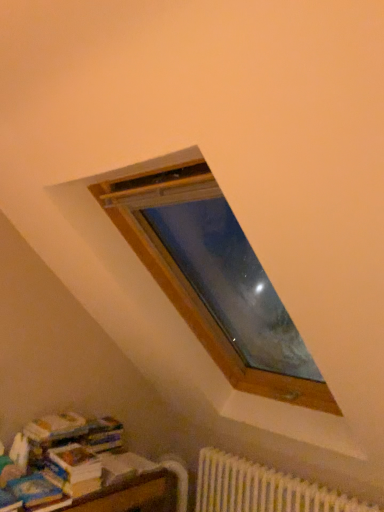
Describe the element at coordinates (34, 490) in the screenshot. The height and width of the screenshot is (512, 384). I see `blue matte paperback book at lower left` at that location.

At what (x,y) coordinates should I click in order to perform the action: click on white plastic radiator at lower right. Please return your answer as a coordinate pair (x, y). This screenshot has height=512, width=384. Looking at the image, I should click on (262, 489).

Describe the element at coordinates (56, 461) in the screenshot. I see `white paper book at lower left` at that location.

Locate an element on the screen. The image size is (384, 512). blue matte paperback book at lower left is located at coordinates (34, 490).

Is blue matte paperback book at lower left wider than white plastic radiator at lower right?

Correct, the width of blue matte paperback book at lower left exceeds that of white plastic radiator at lower right.

Between blue matte paperback book at lower left and white plastic radiator at lower right, which one is positioned in front?

blue matte paperback book at lower left is in front.

This screenshot has height=512, width=384. In order to click on paperback book that is in front of the white plastic radiator at lower right in this screenshot , I will do `click(34, 490)`.

Considering the relative sizes of blue matte paperback book at lower left and white plastic radiator at lower right in the image provided, is blue matte paperback book at lower left taller than white plastic radiator at lower right?

Incorrect, the height of blue matte paperback book at lower left is not larger of that of white plastic radiator at lower right.

Is white paper book at lower left with white plastic radiator at lower right?

No, white paper book at lower left is not making contact with white plastic radiator at lower right.

Is white plastic radiator at lower right surrounded by white paper book at lower left?

No.

Considering the sizes of objects white paper book at lower left and white plastic radiator at lower right in the image provided, who is bigger, white paper book at lower left or white plastic radiator at lower right?

Bigger between the two is white plastic radiator at lower right.

From a real-world perspective, is white paper book at lower left physically located above or below white plastic radiator at lower right?

white paper book at lower left is above white plastic radiator at lower right.

Would you say white plastic radiator at lower right is a long distance from white paper book at lower left?

No, there isn't a large distance between white plastic radiator at lower right and white paper book at lower left.

Locate an element on the screen. The image size is (384, 512). book above the white plastic radiator at lower right (from the image's perspective) is located at coordinates (56, 461).

Is white plastic radiator at lower right surrounding white paper book at lower left?

No, white plastic radiator at lower right does not contain white paper book at lower left.

Relative to white paper book at lower left, is white plastic radiator at lower right in front or behind?

Clearly, white plastic radiator at lower right is in front of white paper book at lower left.

Does blue matte paperback book at lower left touch white paper book at lower left?

No.

From a real-world perspective, does blue matte paperback book at lower left sit lower than white paper book at lower left?

Indeed, from a real-world perspective, blue matte paperback book at lower left is positioned beneath white paper book at lower left.

Is white paper book at lower left at the back of blue matte paperback book at lower left?

blue matte paperback book at lower left does not have its back to white paper book at lower left.

Would you say blue matte paperback book at lower left is inside or outside white paper book at lower left?

blue matte paperback book at lower left is not enclosed by white paper book at lower left.

Do you think white plastic radiator at lower right is within blue matte paperback book at lower left, or outside of it?

white plastic radiator at lower right is spatially situated outside blue matte paperback book at lower left.

Between white plastic radiator at lower right and blue matte paperback book at lower left, which one appears on the left side from the viewer's perspective?

Positioned to the left is blue matte paperback book at lower left.

Is blue matte paperback book at lower left at the back of white plastic radiator at lower right?

No.

From a real-world perspective, which is physically above, white plastic radiator at lower right or blue matte paperback book at lower left?

blue matte paperback book at lower left, from a real-world perspective.

From a real-world perspective, is white paper book at lower left physically below blue matte paperback book at lower left?

Actually, white paper book at lower left is physically above blue matte paperback book at lower left in the real world.

How many degrees apart are the facing directions of white paper book at lower left and blue matte paperback book at lower left?

The facing directions of white paper book at lower left and blue matte paperback book at lower left are 0.768 degrees apart.

Is white paper book at lower left facing away from blue matte paperback book at lower left?

No, white paper book at lower left is not facing away from blue matte paperback book at lower left.

Which of these two, white paper book at lower left or blue matte paperback book at lower left, stands taller?

white paper book at lower left is taller.

The width and height of the screenshot is (384, 512). Identify the location of paperback book on the left of white plastic radiator at lower right. pos(34,490).

In the image, there is a white plastic radiator at lower right. At what (x,y) coordinates should I click in order to perform the action: click on book above it (from the image's perspective). Please return your answer as a coordinate pair (x, y). This screenshot has height=512, width=384. Looking at the image, I should click on (56, 461).

Considering their positions, is white paper book at lower left positioned further to white plastic radiator at lower right than blue matte paperback book at lower left?

Among the two, blue matte paperback book at lower left is located further to white plastic radiator at lower right.

From the image, which object appears to be nearer to white plastic radiator at lower right, blue matte paperback book at lower left or white paper book at lower left?

white paper book at lower left is closer to white plastic radiator at lower right.

Looking at the image, which one is located closer to white paper book at lower left, blue matte paperback book at lower left or white plastic radiator at lower right?

Among the two, blue matte paperback book at lower left is located nearer to white paper book at lower left.

Based on their spatial positions, is white paper book at lower left or white plastic radiator at lower right further from blue matte paperback book at lower left?

The object further to blue matte paperback book at lower left is white plastic radiator at lower right.

Looking at the image, which one is located further to white paper book at lower left, white plastic radiator at lower right or blue matte paperback book at lower left?

Among the two, white plastic radiator at lower right is located further to white paper book at lower left.

Based on their spatial positions, is white plastic radiator at lower right or white paper book at lower left further from blue matte paperback book at lower left?

white plastic radiator at lower right is further to blue matte paperback book at lower left.

You are a GUI agent. You are given a task and a screenshot of the screen. Output one action in this format:
    pyautogui.click(x=<x>, y=<y>)
    Task: Click on the book between blue matte paperback book at lower left and white plastic radiator at lower right in the horizontal direction
    This screenshot has width=384, height=512.
    Given the screenshot: What is the action you would take?
    pyautogui.click(x=56, y=461)